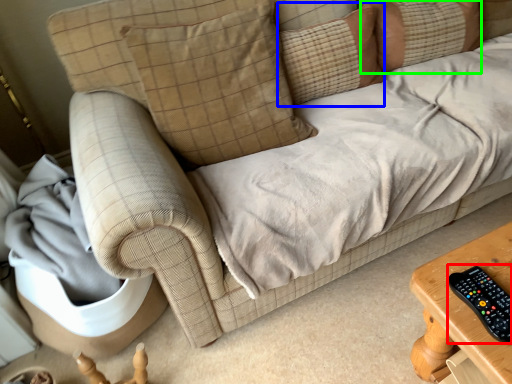
Question: Which object is the farthest from control (highlighted by a red box)? Choose among these: pillow (highlighted by a blue box) or pillow (highlighted by a green box).

Choices:
 (A) pillow
 (B) pillow

Answer: (B)